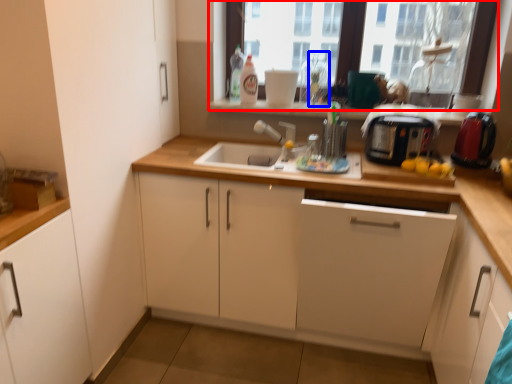
Question: Which point is further to the camera, window (highlighted by a red box) or bottle (highlighted by a blue box)?

Choices:
 (A) window
 (B) bottle

Answer: (B)